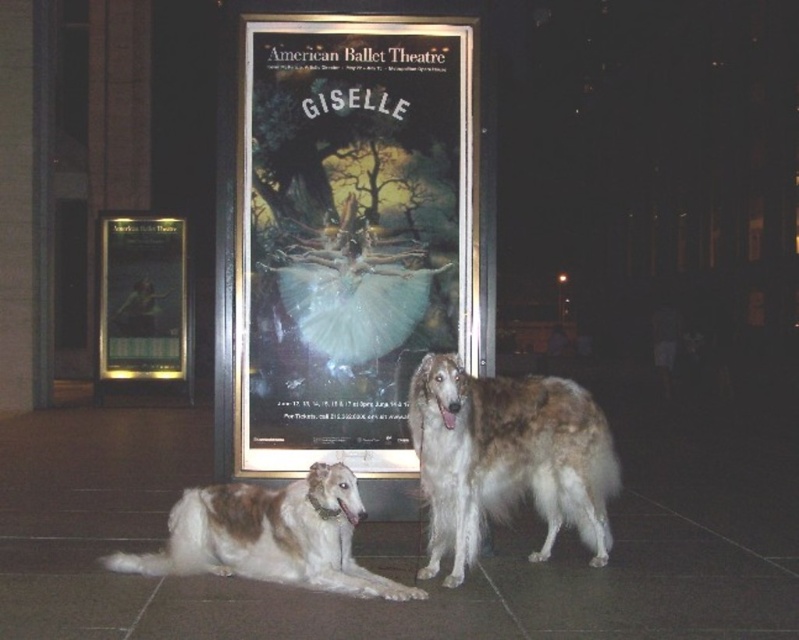
Question: Which point appears farthest from the camera in this image?

Choices:
 (A) (539, 483)
 (B) (356, 131)
 (C) (163, 317)
 (D) (315, 344)

Answer: (C)

Question: Which point appears farthest from the camera in this image?

Choices:
 (A) (315, 464)
 (B) (396, 392)
 (C) (360, 310)

Answer: (C)

Question: Which object is farther from the camera taking this photo?

Choices:
 (A) matte glass poster at center
 (B) brown and white fur at lower left

Answer: (A)

Question: Can you confirm if gold-framed poster at center is positioned above matte glass poster at center?

Choices:
 (A) no
 (B) yes

Answer: (B)

Question: Can you confirm if gold-framed poster at center is smaller than brown and white fur at center?

Choices:
 (A) yes
 (B) no

Answer: (A)

Question: Does gold-framed poster at center appear under white fluffy tutu at center?

Choices:
 (A) yes
 (B) no

Answer: (B)